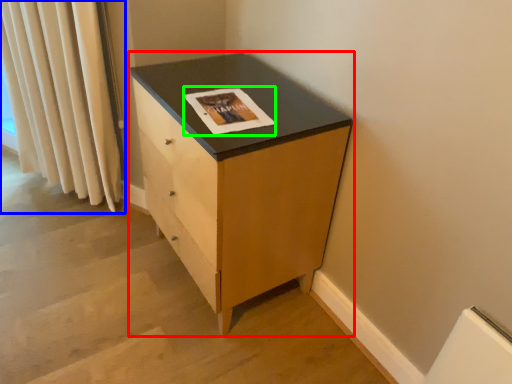
Question: Which object is positioned closest to chest of drawers (highlighted by a red box)? Select from curtain (highlighted by a blue box) and magazine (highlighted by a green box).

Choices:
 (A) curtain
 (B) magazine

Answer: (B)